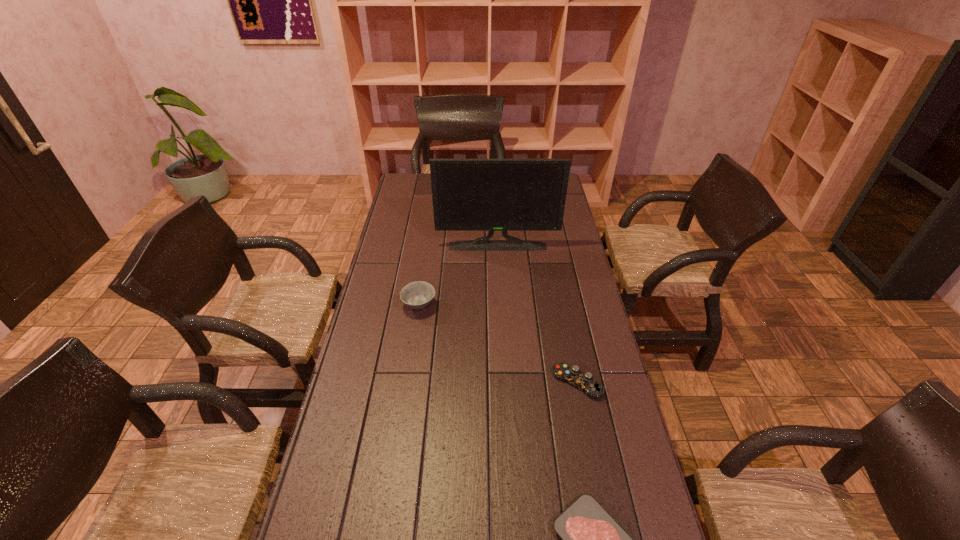
The height and width of the screenshot is (540, 960). What are the coordinates of `monitor that is at the right edge` in the screenshot? It's located at (491, 195).

Identify the location of control that is at the right edge. The width and height of the screenshot is (960, 540). (584, 381).

Locate an element on the screen. The image size is (960, 540). blank space at the left edge of the desktop is located at coordinates (323, 465).

In the image, there is a desktop. Where is `vacant area at the right edge`? This screenshot has height=540, width=960. vacant area at the right edge is located at coordinates (599, 318).

At what (x,y) coordinates should I click in order to perform the action: click on vacant area between the bowl and the tallest object. Please return your answer as a coordinate pair (x, y). Looking at the image, I should click on (458, 276).

Image resolution: width=960 pixels, height=540 pixels. Find the location of `vacant region between the monitor and the second farthest object`. vacant region between the monitor and the second farthest object is located at coordinates (458, 276).

Find the location of a particular element. The height and width of the screenshot is (540, 960). free space between the control and the tallest object is located at coordinates (538, 314).

You are a GUI agent. You are given a task and a screenshot of the screen. Output one action in this format:
    pyautogui.click(x=<x>, y=<y>)
    Task: Click on the vacant region between the third nearest object and the control
    
    Given the screenshot: What is the action you would take?
    pyautogui.click(x=498, y=344)

Identify the location of free space between the third nearest object and the second nearest object. (498, 344).

Where is `vacant area between the monitor and the second nearest object`? vacant area between the monitor and the second nearest object is located at coordinates (538, 314).